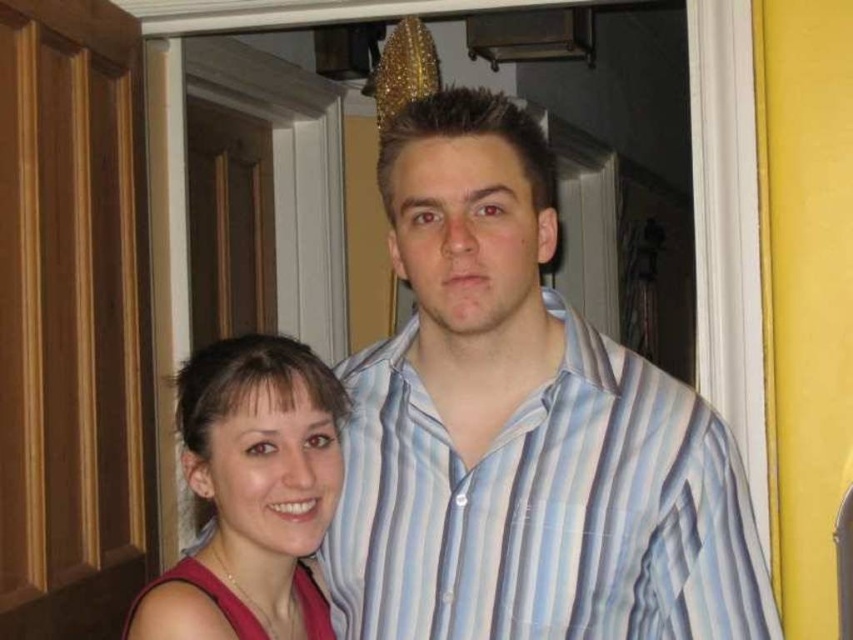
You are organizing a clothing rack and need to place the pink fabric dress at lower left and the striped cotton shirt at center. Since the rack has limited vertical space, which item should you place higher up to ensure both fit without overlapping?

The pink fabric dress at lower left is taller than the striped cotton shirt at center, so you should place the pink fabric dress at lower left higher up on the rack to accommodate its greater height while making space for the shorter striped cotton shirt at center below.

You are an interior designer analyzing the spatial layout of this room. The pink fabric dress at lower left is positioned at coordinates 0.672, 0.613. If you want to place a small table next to it without overlapping, where should you position the table in terms of coordinates?

The pink fabric dress at lower left is located at coordinates (521, 429). To place a small table next to it without overlapping, you should position the table slightly to the right or left of these coordinates, ensuring a minimal distance to avoid overlap. For example, adjusting the x or y coordinate by a small margin like 0.05 would work.

You are organizing a clothing rack and need to arrange the pink fabric dress at lower left and the matte pink tank top at lower left based on their positions. Which item is positioned more to the left?

The matte pink tank top at lower left is positioned more to the left since the pink fabric dress at lower left is to its right.